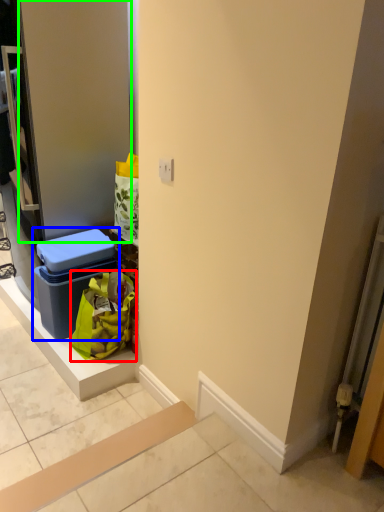
Question: Based on their relative distances, which object is farther from shopping bag (highlighted by a red box)? Choose from storage box (highlighted by a blue box) and door (highlighted by a green box).

Choices:
 (A) storage box
 (B) door

Answer: (B)